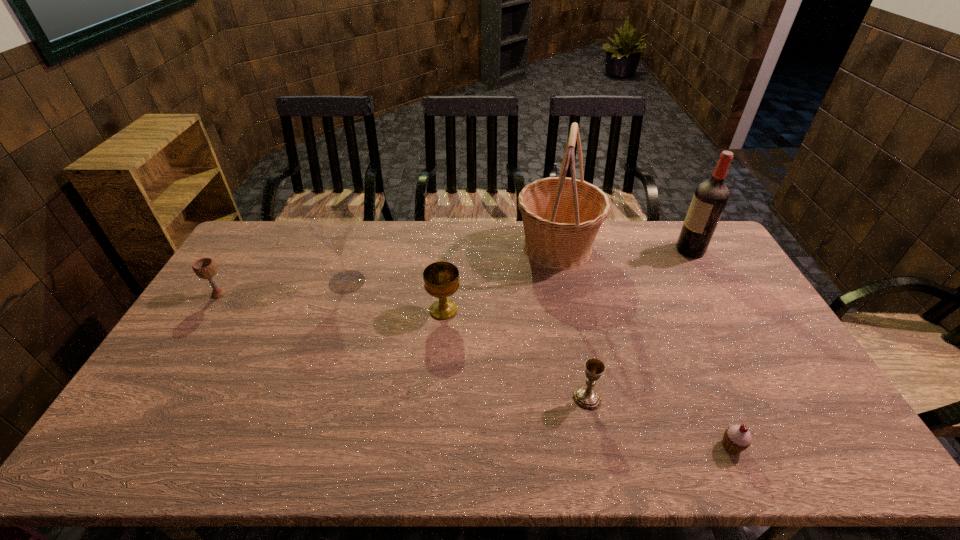
Locate an element on the screen. This screenshot has height=540, width=960. vacant space at the far left corner of the desktop is located at coordinates (261, 259).

You are a GUI agent. You are given a task and a screenshot of the screen. Output one action in this format:
    pyautogui.click(x=<x>, y=<y>)
    Task: Click on the vacant area that lies between the leftmost chalice and the nearest object
    
    Given the screenshot: What is the action you would take?
    (475, 370)

At what (x,y) coordinates should I click in order to perform the action: click on vacant space that's between the rightmost chalice and the liquor. Please return your answer as a coordinate pair (x, y). The height and width of the screenshot is (540, 960). Looking at the image, I should click on (638, 324).

Find the location of a particular element. vacant space in between the fifth shortest object and the leftmost chalice is located at coordinates (283, 288).

Find the location of `empty location between the fifth shortest object and the tallest chalice`. empty location between the fifth shortest object and the tallest chalice is located at coordinates (396, 296).

The width and height of the screenshot is (960, 540). I want to click on free spot between the second chalice from left to right and the flute glass, so click(x=396, y=296).

This screenshot has height=540, width=960. Identify the location of empty space that is in between the leftmost chalice and the second object from left to right. (283, 288).

Find the location of `free space that is in between the fifth object from right to left and the fifth shortest object`. free space that is in between the fifth object from right to left and the fifth shortest object is located at coordinates (396, 296).

Where is `vacant point located between the tallest object and the rightmost chalice`? Image resolution: width=960 pixels, height=540 pixels. vacant point located between the tallest object and the rightmost chalice is located at coordinates (572, 322).

Identify the location of free spot between the leftmost chalice and the sixth object from right to left. This screenshot has height=540, width=960. (283, 288).